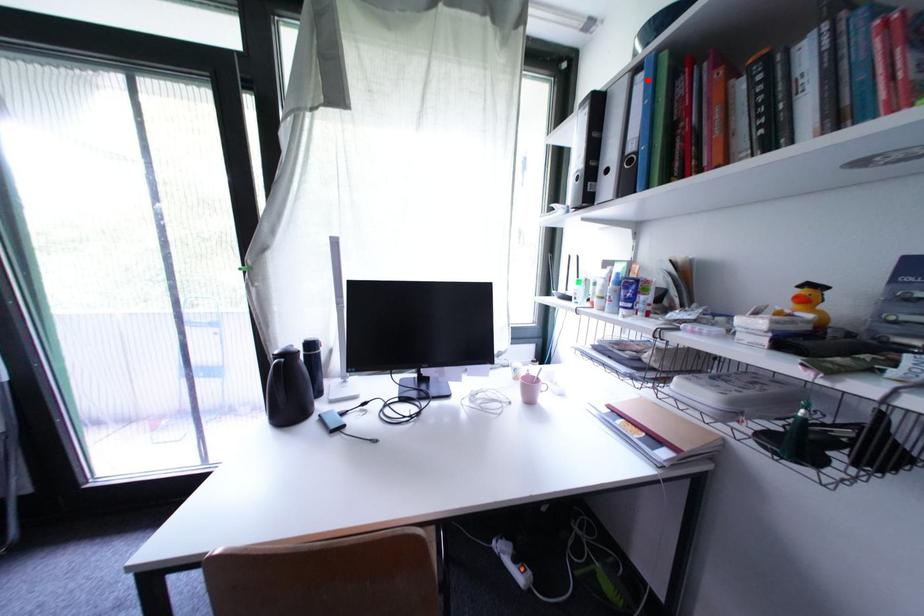
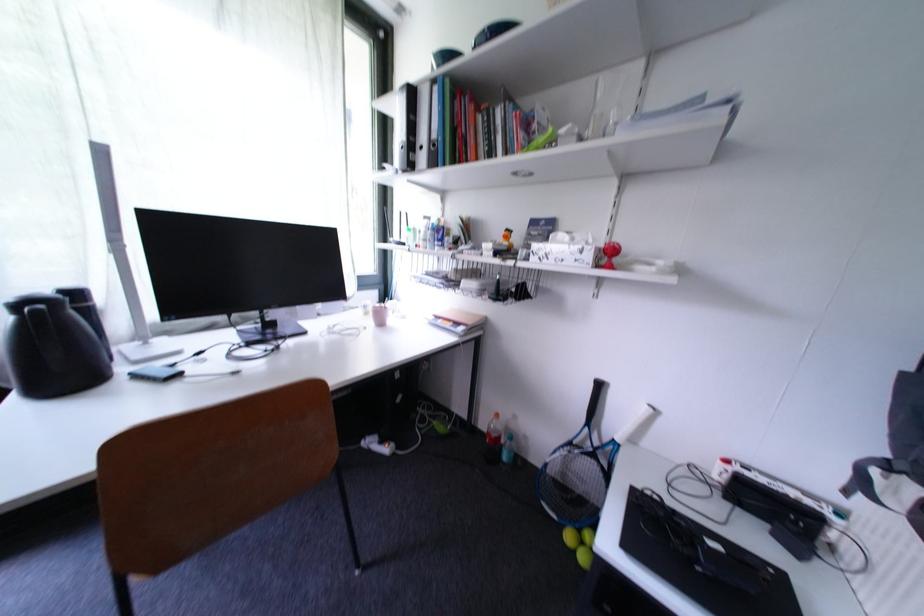
Question: I am providing you with two images of the same scene from different viewpoints. A red point is marked on the first image. Is the red point's position out of view in image 2?

Choices:
 (A) Yes
 (B) No

Answer: (B)